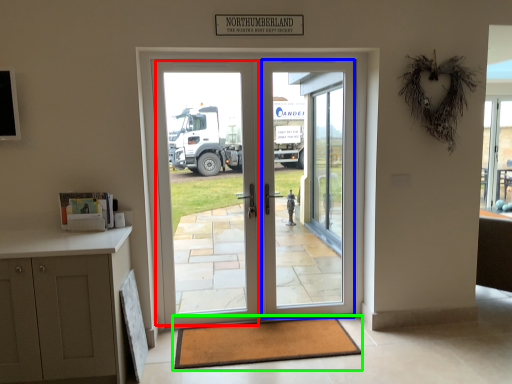
Question: Which object is positioned closest to screen door (highlighted by a red box)? Select from screen door (highlighted by a blue box) and mat (highlighted by a green box).

Choices:
 (A) screen door
 (B) mat

Answer: (A)